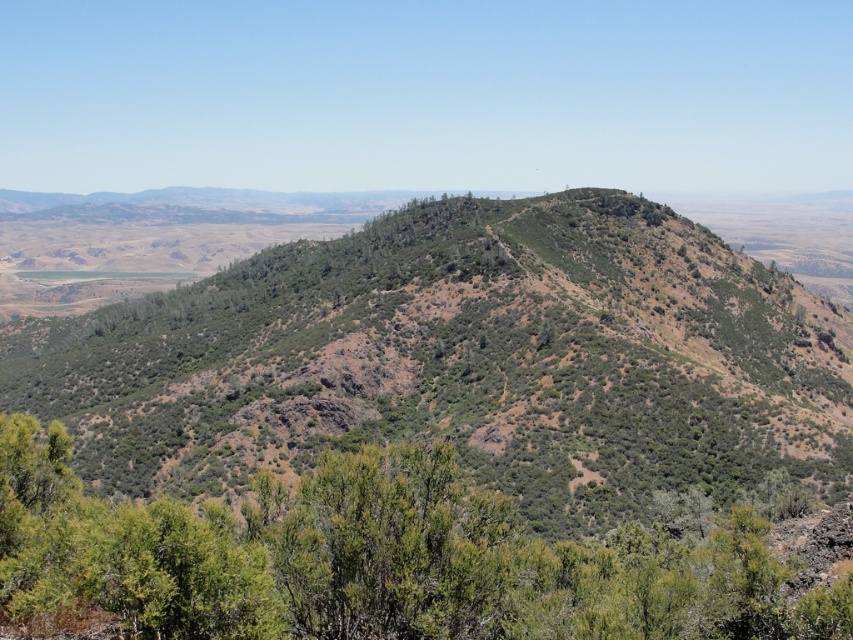
Question: Does green shrubbery at center appear under green leafy shrub at center?

Choices:
 (A) yes
 (B) no

Answer: (B)

Question: Which of the following is the farthest from the observer?

Choices:
 (A) green leafy shrub at center
 (B) green shrubbery at center

Answer: (B)

Question: Is green shrubbery at center smaller than green leafy shrub at center?

Choices:
 (A) yes
 (B) no

Answer: (B)

Question: Can you confirm if green shrubbery at center is positioned to the right of green leafy shrub at center?

Choices:
 (A) no
 (B) yes

Answer: (A)

Question: Which object appears closest to the camera in this image?

Choices:
 (A) green leafy shrub at center
 (B) green shrubbery at center

Answer: (A)